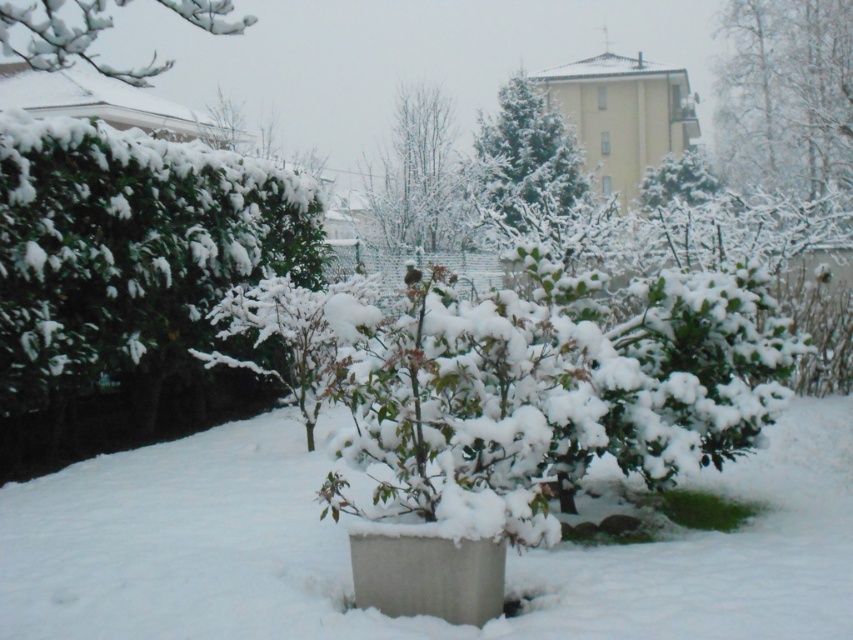
Question: Considering the real-world distances, which object is farthest from the bare branches at center?

Choices:
 (A) green matte tree at upper center
 (B) white snow-covered tree at upper right
 (C) white snow-covered branch at upper left
 (D) white fluffy tree at upper center

Answer: (B)

Question: Is white matte snow at center smaller than bare branches at center?

Choices:
 (A) yes
 (B) no

Answer: (A)

Question: Which object is the closest to the white snow-covered branch at upper left?

Choices:
 (A) white matte snow at center
 (B) white fluffy tree at upper center
 (C) bare branches at center
 (D) white snow-covered tree at upper right

Answer: (C)

Question: Is white matte snow at center above white fluffy tree at upper center?

Choices:
 (A) yes
 (B) no

Answer: (B)

Question: Which of the following is the farthest from the observer?

Choices:
 (A) (247, 26)
 (B) (695, 193)
 (C) (438, 195)
 (D) (659, 612)

Answer: (A)

Question: Can you confirm if bare branches at center is positioned above white snow-covered branch at upper left?

Choices:
 (A) yes
 (B) no

Answer: (B)